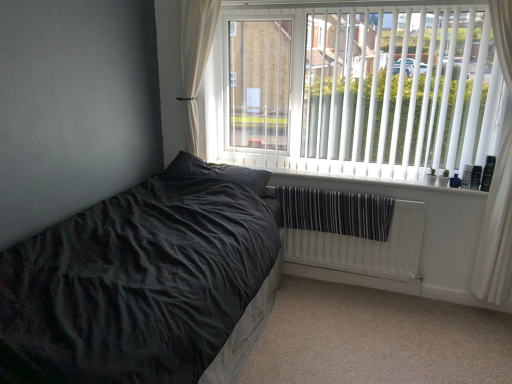
Question: Is white textured radiator at lower right at the right side of velvet black bed at lower left?

Choices:
 (A) yes
 (B) no

Answer: (A)

Question: Is the position of white textured radiator at lower right more distant than that of velvet black bed at lower left?

Choices:
 (A) no
 (B) yes

Answer: (B)

Question: Does white textured radiator at lower right have a greater height compared to velvet black bed at lower left?

Choices:
 (A) no
 (B) yes

Answer: (A)

Question: Considering the relative sizes of white textured radiator at lower right and velvet black bed at lower left in the image provided, is white textured radiator at lower right bigger than velvet black bed at lower left?

Choices:
 (A) no
 (B) yes

Answer: (A)

Question: Is white textured radiator at lower right wider than velvet black bed at lower left?

Choices:
 (A) yes
 (B) no

Answer: (B)

Question: From a real-world perspective, is white plastic radiator at lower center physically located above or below white vertical blinds at upper right?

Choices:
 (A) above
 (B) below

Answer: (B)

Question: Considering the relative positions of white plastic radiator at lower center and white vertical blinds at upper right in the image provided, is white plastic radiator at lower center to the left or to the right of white vertical blinds at upper right?

Choices:
 (A) left
 (B) right

Answer: (A)

Question: Is white plastic radiator at lower center inside or outside of white vertical blinds at upper right?

Choices:
 (A) inside
 (B) outside

Answer: (B)

Question: Is white plastic radiator at lower center wider or thinner than white vertical blinds at upper right?

Choices:
 (A) wide
 (B) thin

Answer: (A)

Question: Would you say white plastic radiator at lower center is to the left or to the right of velvet black bed at lower left in the picture?

Choices:
 (A) right
 (B) left

Answer: (A)

Question: Relative to velvet black bed at lower left, is white plastic radiator at lower center in front or behind?

Choices:
 (A) behind
 (B) front

Answer: (A)

Question: From a real-world perspective, relative to velvet black bed at lower left, is white plastic radiator at lower center vertically above or below?

Choices:
 (A) above
 (B) below

Answer: (A)

Question: In terms of size, does white plastic radiator at lower center appear bigger or smaller than velvet black bed at lower left?

Choices:
 (A) small
 (B) big

Answer: (A)

Question: From the image's perspective, is white textured radiator at lower right located above or below white sheer curtain at upper left, the 2th curtain viewed from the right?

Choices:
 (A) above
 (B) below

Answer: (B)

Question: In the image, is white textured radiator at lower right on the left side or the right side of white sheer curtain at upper left, the 2th curtain viewed from the right?

Choices:
 (A) left
 (B) right

Answer: (B)